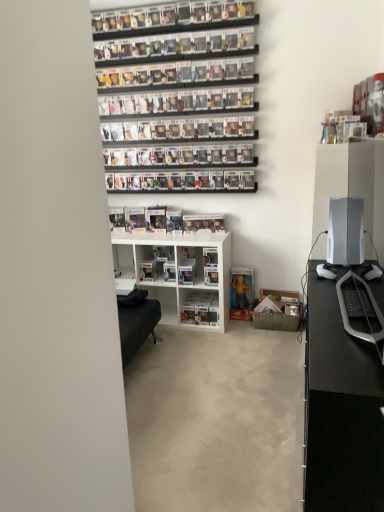
Question: Can you confirm if clear plastic figure at center is smaller than white plastic shelf at center, the first shelf when ordered from right to left?

Choices:
 (A) no
 (B) yes

Answer: (B)

Question: Is the position of clear plastic figure at center less distant than that of white plastic shelf at center, which is the 2th shelf in left-to-right order?

Choices:
 (A) yes
 (B) no

Answer: (B)

Question: Can you confirm if clear plastic figure at center is positioned to the left of white plastic shelf at center, the first shelf when ordered from right to left?

Choices:
 (A) yes
 (B) no

Answer: (A)

Question: Is clear plastic figure at center bigger than white plastic shelf at center, which is the 2th shelf in left-to-right order?

Choices:
 (A) yes
 (B) no

Answer: (B)

Question: Can you confirm if clear plastic figure at center is shorter than white plastic shelf at center, which is the 2th shelf in left-to-right order?

Choices:
 (A) no
 (B) yes

Answer: (B)

Question: Is clear plastic figure at center facing towards white plastic shelf at center, which is the 2th shelf in left-to-right order?

Choices:
 (A) yes
 (B) no

Answer: (B)

Question: Is white plastic shelf at center, the first shelf when ordered from right to left, far from clear plastic figure at center?

Choices:
 (A) no
 (B) yes

Answer: (A)

Question: Is white plastic shelf at center, which is the 2th shelf in left-to-right order, outside clear plastic figure at center?

Choices:
 (A) no
 (B) yes

Answer: (B)

Question: Does white plastic shelf at center, which is the 2th shelf in left-to-right order, come behind clear plastic figure at center?

Choices:
 (A) yes
 (B) no

Answer: (B)

Question: Is white plastic shelf at center, which is the 2th shelf in left-to-right order, in front of clear plastic figure at center?

Choices:
 (A) yes
 (B) no

Answer: (A)

Question: Can you confirm if white plastic shelf at center, the first shelf when ordered from right to left, is taller than clear plastic figure at center?

Choices:
 (A) no
 (B) yes

Answer: (B)

Question: Could clear plastic figure at center be considered to be inside white plastic shelf at center, the first shelf when ordered from right to left?

Choices:
 (A) no
 (B) yes

Answer: (A)

Question: Does clear plastic figure at center have a greater height compared to yellow matte action figure at lower center?

Choices:
 (A) yes
 (B) no

Answer: (B)